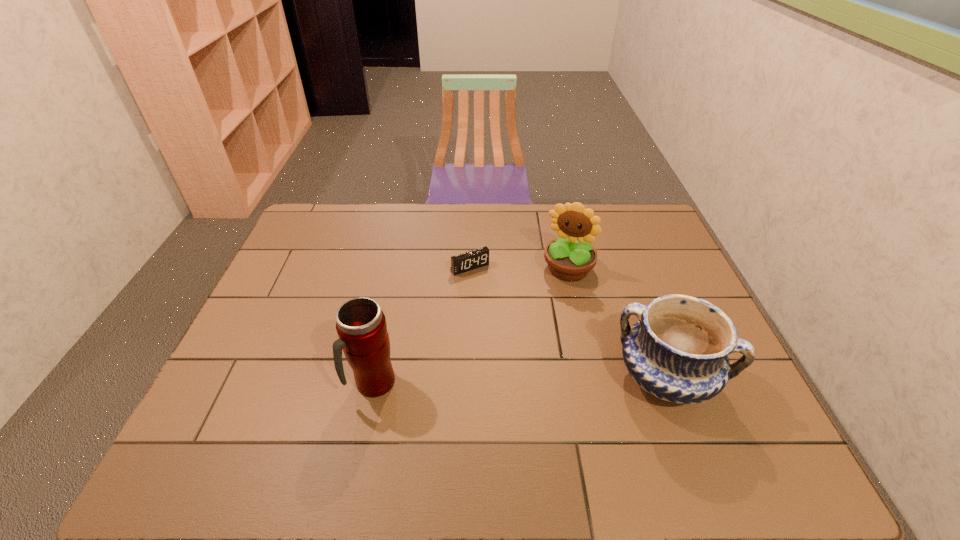
Locate an element on the screen. This screenshot has width=960, height=540. thermos bottle is located at coordinates (361, 325).

Locate an element on the screen. pottery is located at coordinates (678, 351).

This screenshot has width=960, height=540. Find the location of `alarm clock`. alarm clock is located at coordinates (477, 258).

This screenshot has width=960, height=540. Identify the location of the second object from left to right. (477, 258).

This screenshot has width=960, height=540. Identify the location of sunflower. (570, 258).

You are a GUI agent. You are given a task and a screenshot of the screen. Output one action in this format:
    pyautogui.click(x=<x>, y=<y>)
    Task: Click on the free region located 0.050m on the side with the handle of the thermos bottle
    
    Given the screenshot: What is the action you would take?
    pyautogui.click(x=365, y=424)

This screenshot has width=960, height=540. I want to click on vacant space located 0.160m on the back of the pottery, so click(x=636, y=299).

What are the coordinates of `free space located 0.060m on the front-facing side of the shortest object` in the screenshot? It's located at pyautogui.click(x=487, y=287).

Identify the location of free space located 0.100m on the front-facing side of the shortest object. This screenshot has height=540, width=960. (492, 295).

Where is `vacant region located 0.230m on the front-facing side of the shortest object`? This screenshot has height=540, width=960. vacant region located 0.230m on the front-facing side of the shortest object is located at coordinates (515, 325).